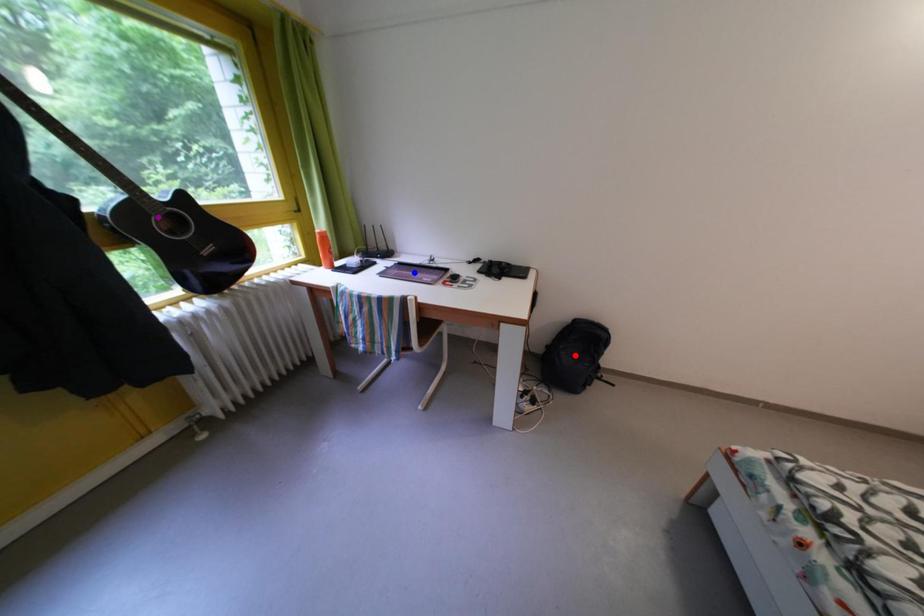
Order these from nearest to farthest:
purple point, red point, blue point

purple point → blue point → red point